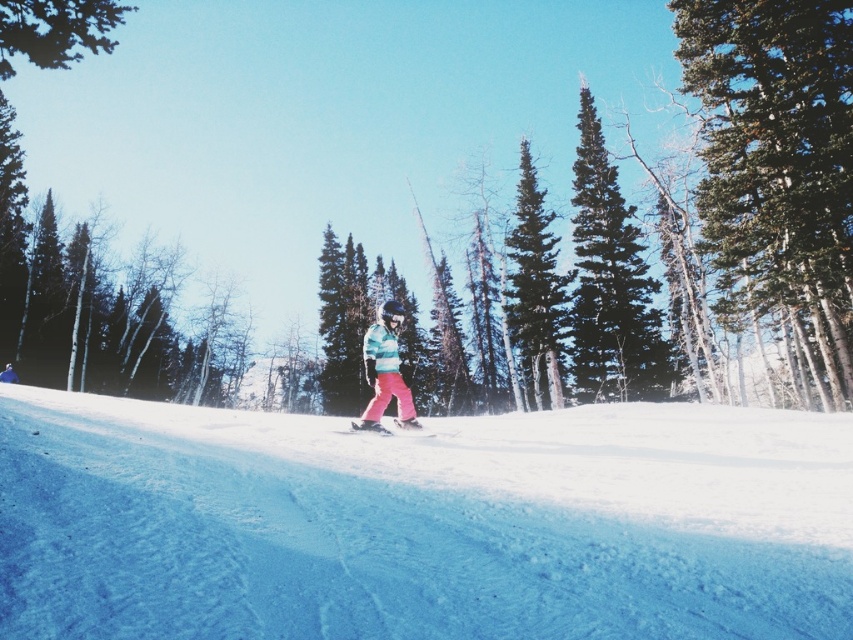
Question: Observing the image, what is the correct spatial positioning of white snow at center in reference to pink fabric ski at center?

Choices:
 (A) left
 (B) right

Answer: (A)

Question: Can you confirm if green textured pine tree at upper right is wider than green coniferous tree at center?

Choices:
 (A) yes
 (B) no

Answer: (A)

Question: In this image, where is green coniferous tree at center located relative to green leafy tree at upper left?

Choices:
 (A) below
 (B) above

Answer: (A)

Question: Which of these objects is positioned closest to the green textured pine tree at upper right?

Choices:
 (A) pink fabric ski at center
 (B) green textured pine tree at center
 (C) green coniferous tree at center

Answer: (C)

Question: Which of the following is the farthest from the observer?

Choices:
 (A) (369, 337)
 (B) (526, 182)
 (C) (820, 35)
 (D) (432, 557)

Answer: (B)

Question: Estimate the real-world distances between objects in this image. Which object is closer to the green textured pine tree at upper right?

Choices:
 (A) green textured pine tree at center
 (B) striped fleece jacket at center
 (C) white snow at center
 (D) green leafy tree at upper left

Answer: (C)